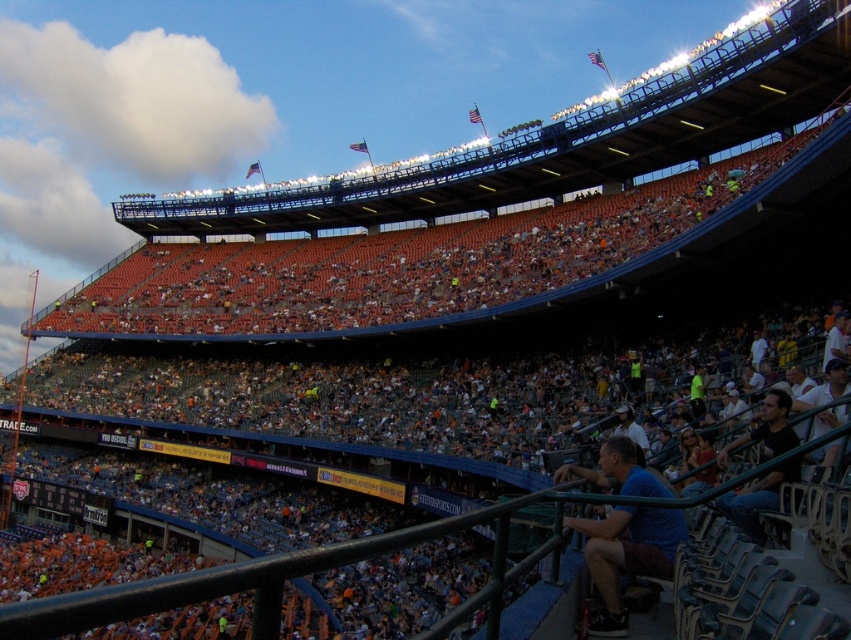
You are standing at the center of the stadium and want to reach the point marked at coordinates point (x=604, y=602). Given that your maximum walking distance is 100 feet, can you comfortably reach the point without exceeding your limit?

The point (x=604, y=602) is 115.23 feet away from the viewer, which exceeds your maximum walking distance of 100 feet. Therefore, you cannot comfortably reach the point without exceeding your limit.

You are a photographer standing at the edge of the stadium field. You notice two shirts in the lower right section of the stands. The blue cotton shirt at lower right and the white fabric shirt at lower right. If your camera has a zoom lens capable of focusing on objects up to 12 meters away, can you clearly capture both shirts in a single photo without moving your position?

The blue cotton shirt at lower right is 12.89 meters from the white fabric shirt at lower right. Since the maximum distance your camera can focus is 12 meters, the distance between the two shirts exceeds this range. Therefore, you cannot clearly capture both shirts in a single photo without moving.